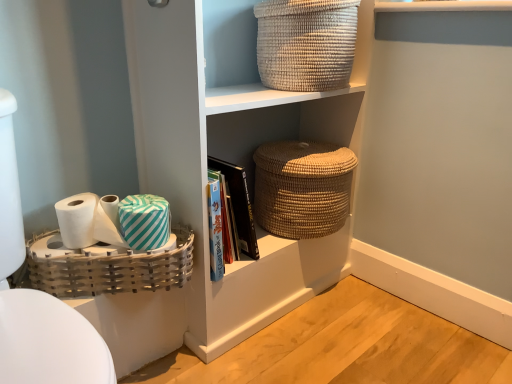
This screenshot has height=384, width=512. What do you see at coordinates (108, 222) in the screenshot?
I see `white matte toilet paper at lower left, the first toilet paper from the right` at bounding box center [108, 222].

Locate an element on the screen. The height and width of the screenshot is (384, 512). white matte toilet paper at lower left, the first toilet paper from the right is located at coordinates (108, 222).

From the picture: What is the approximate height of white matte toilet paper at lower left, the 1th toilet paper positioned from the left?

4.27 inches.

Image resolution: width=512 pixels, height=384 pixels. In order to click on natural woven basket at center in this screenshot , I will do `click(260, 288)`.

Locate an element on the screen. This screenshot has height=384, width=512. natural woven basket at center, the 2th basket viewed from the top is located at coordinates (302, 188).

What do you see at coordinates (239, 204) in the screenshot?
I see `hardcover book at center` at bounding box center [239, 204].

At what (x,y) coordinates should I click in order to perform the action: click on white matte toilet paper at lower left, the second toilet paper viewed from the left. Please return your answer as a coordinate pair (x, y). This screenshot has width=512, height=384. Looking at the image, I should click on (108, 222).

Measure the distance from natural woven basket at upper center, the 1th basket positioned from the top, to white glossy toilet bowl at left.

A distance of 31.51 inches exists between natural woven basket at upper center, the 1th basket positioned from the top, and white glossy toilet bowl at left.

From the picture: Is natural woven basket at upper center, the 3th basket in the bottom-to-top sequence, turned away from white glossy toilet bowl at left?

No, natural woven basket at upper center, the 3th basket in the bottom-to-top sequence, is not facing the opposite direction of white glossy toilet bowl at left.

From a real-world perspective, relative to white glossy toilet bowl at left, is natural woven basket at upper center, the 1th basket positioned from the top, vertically above or below?

From a real-world perspective, natural woven basket at upper center, the 1th basket positioned from the top, is physically above white glossy toilet bowl at left.

Is teal striped fabric at lower left positioned behind woven bamboo basket at lower left, which is the 1th basket from bottom to top?

Yes.

Which is closer to the camera, (139, 226) or (140, 289)?

Point (139, 226) appears to be closer to the viewer than point (140, 289).

Does teal striped fabric at lower left turn towards woven bamboo basket at lower left, which is counted as the 3th basket, starting from the top?

No, teal striped fabric at lower left is not oriented towards woven bamboo basket at lower left, which is counted as the 3th basket, starting from the top.

Can we say teal striped fabric at lower left lies outside woven bamboo basket at lower left, which is counted as the 3th basket, starting from the top?

Yes, teal striped fabric at lower left is outside of woven bamboo basket at lower left, which is counted as the 3th basket, starting from the top.

From the picture: Do you think hardcover book at center is within white glossy toilet bowl at left, or outside of it?

hardcover book at center is outside white glossy toilet bowl at left.

Which is in front, hardcover book at center or white glossy toilet bowl at left?

white glossy toilet bowl at left is closer to the camera.

In terms of height, does hardcover book at center look taller or shorter compared to white glossy toilet bowl at left?

hardcover book at center is shorter than white glossy toilet bowl at left.

Can you confirm if hardcover book at center is bigger than white glossy toilet bowl at left?

No.

From the image's perspective, relative to white matte toilet paper at lower left, the second toilet paper viewed from the left, is woven bamboo basket at lower left, which is the 1th basket from bottom to top, above or below?

woven bamboo basket at lower left, which is the 1th basket from bottom to top, is situated lower than white matte toilet paper at lower left, the second toilet paper viewed from the left, in the image.

Considering the relative sizes of woven bamboo basket at lower left, which is the 1th basket from bottom to top, and white matte toilet paper at lower left, the second toilet paper viewed from the left, in the image provided, is woven bamboo basket at lower left, which is the 1th basket from bottom to top, wider than white matte toilet paper at lower left, the second toilet paper viewed from the left,?

Correct, the width of woven bamboo basket at lower left, which is the 1th basket from bottom to top, exceeds that of white matte toilet paper at lower left, the second toilet paper viewed from the left.

Does woven bamboo basket at lower left, which is counted as the 3th basket, starting from the top, appear on the right side of white matte toilet paper at lower left, the second toilet paper viewed from the left?

Indeed, woven bamboo basket at lower left, which is counted as the 3th basket, starting from the top, is positioned on the right side of white matte toilet paper at lower left, the second toilet paper viewed from the left.

From a real-world perspective, does white glossy toilet bowl at left sit lower than white matte toilet paper at lower left, the 1th toilet paper positioned from the left?

Indeed, from a real-world perspective, white glossy toilet bowl at left is positioned beneath white matte toilet paper at lower left, the 1th toilet paper positioned from the left.

Looking at the image, does white glossy toilet bowl at left seem bigger or smaller compared to white matte toilet paper at lower left, the 1th toilet paper positioned from the left?

Clearly, white glossy toilet bowl at left is larger in size than white matte toilet paper at lower left, the 1th toilet paper positioned from the left.

Based on the photo, does white glossy toilet bowl at left lie in front of white matte toilet paper at lower left, placed as the 2th toilet paper when sorted from right to left?

Yes, the depth of white glossy toilet bowl at left is less than that of white matte toilet paper at lower left, placed as the 2th toilet paper when sorted from right to left.

Does point (9, 313) appear closer or farther from the camera than point (170, 238)?

Point (9, 313) appears to be closer to the viewer than point (170, 238).

Could you tell me if hardcover book at center is facing teal striped fabric at lower left?

No, hardcover book at center is not oriented towards teal striped fabric at lower left.

What's the angular difference between hardcover book at center and teal striped fabric at lower left's facing directions?

4.01 degrees.

From the image's perspective, which is above, hardcover book at center or teal striped fabric at lower left?

teal striped fabric at lower left.

Would you say hardcover book at center is outside teal striped fabric at lower left?

Indeed, hardcover book at center is completely outside teal striped fabric at lower left.

Who is smaller, natural woven basket at upper center, the 1th basket positioned from the top, or hardcover book at center?

hardcover book at center is smaller.

Is natural woven basket at upper center, the 1th basket positioned from the top, to the right of hardcover book at center from the viewer's perspective?

Yes.

Would you say hardcover book at center is part of natural woven basket at upper center, the 3th basket in the bottom-to-top sequence,'s contents?

Definitely not — hardcover book at center is not inside natural woven basket at upper center, the 3th basket in the bottom-to-top sequence.

Does natural woven basket at upper center, the 1th basket positioned from the top, lie in front of hardcover book at center?

Yes, the depth of natural woven basket at upper center, the 1th basket positioned from the top, is less than that of hardcover book at center.

This screenshot has width=512, height=384. What are the coordinates of `basket that is the 3rd object located above the white glossy toilet bowl at left (from the image's perspective)` in the screenshot? It's located at (306, 43).

You are a GUI agent. You are given a task and a screenshot of the screen. Output one action in this format:
    pyautogui.click(x=<x>, y=<y>)
    Task: Click on the material behind the woven bamboo basket at lower left, which is counted as the 3th basket, starting from the top
    The width and height of the screenshot is (512, 384).
    Given the screenshot: What is the action you would take?
    tap(144, 221)

From the image, which object appears to be farther from woven bamboo basket at lower left, which is counted as the 3th basket, starting from the top, white matte toilet paper at lower left, the 1th toilet paper positioned from the left, or natural woven basket at center?

natural woven basket at center.

Based on their spatial positions, is woven bamboo basket at lower left, which is the 1th basket from bottom to top, or natural woven basket at center, positioned as the 2th basket in bottom-to-top order, closer to white matte toilet paper at lower left, the second toilet paper viewed from the left?

Based on the image, woven bamboo basket at lower left, which is the 1th basket from bottom to top, appears to be nearer to white matte toilet paper at lower left, the second toilet paper viewed from the left.

From the image, which object appears to be nearer to white matte toilet paper at lower left, the 1th toilet paper positioned from the left, white glossy toilet bowl at left or white matte toilet paper at lower left, the second toilet paper viewed from the left?

The object closer to white matte toilet paper at lower left, the 1th toilet paper positioned from the left, is white matte toilet paper at lower left, the second toilet paper viewed from the left.

Looking at the image, which one is located further to white matte toilet paper at lower left, the first toilet paper from the right, teal striped fabric at lower left or white glossy toilet bowl at left?

white glossy toilet bowl at left is positioned further to the anchor white matte toilet paper at lower left, the first toilet paper from the right.

Which object lies nearer to the anchor point hardcover book at center, natural woven basket at center or natural woven basket at center, the 2th basket viewed from the top?

Among the two, natural woven basket at center, the 2th basket viewed from the top, is located nearer to hardcover book at center.

Considering their positions, is natural woven basket at center, positioned as the 2th basket in bottom-to-top order, positioned further to white matte toilet paper at lower left, the first toilet paper from the right, than natural woven basket at upper center, the 1th basket positioned from the top?

natural woven basket at upper center, the 1th basket positioned from the top, is positioned further to the anchor white matte toilet paper at lower left, the first toilet paper from the right.

Considering their positions, is natural woven basket at center positioned closer to natural woven basket at upper center, the 3th basket in the bottom-to-top sequence, than white matte toilet paper at lower left, placed as the 2th toilet paper when sorted from right to left?

natural woven basket at center is positioned closer to the anchor natural woven basket at upper center, the 3th basket in the bottom-to-top sequence.

Considering their positions, is white glossy toilet bowl at left positioned closer to teal striped fabric at lower left than white matte toilet paper at lower left, the 1th toilet paper positioned from the left?

Among the two, white matte toilet paper at lower left, the 1th toilet paper positioned from the left, is located nearer to teal striped fabric at lower left.

Image resolution: width=512 pixels, height=384 pixels. I want to click on material situated between white matte toilet paper at lower left, the 1th toilet paper positioned from the left, and hardcover book at center from left to right, so click(x=144, y=221).

Image resolution: width=512 pixels, height=384 pixels. Find the location of `cabinet that lies between natural woven basket at upper center, the 3th basket in the bottom-to-top sequence, and woven bamboo basket at lower left, which is counted as the 3th basket, starting from the top, from top to bottom`. cabinet that lies between natural woven basket at upper center, the 3th basket in the bottom-to-top sequence, and woven bamboo basket at lower left, which is counted as the 3th basket, starting from the top, from top to bottom is located at coordinates (260, 288).

Locate an element on the screen. cabinet between white glossy toilet bowl at left and natural woven basket at upper center, the 3th basket in the bottom-to-top sequence, in the front-back direction is located at coordinates (260, 288).

At what (x,y) coordinates should I click in order to perform the action: click on basket that lies between natural woven basket at upper center, the 3th basket in the bottom-to-top sequence, and teal striped fabric at lower left from top to bottom. Please return your answer as a coordinate pair (x, y). This screenshot has height=384, width=512. Looking at the image, I should click on (302, 188).